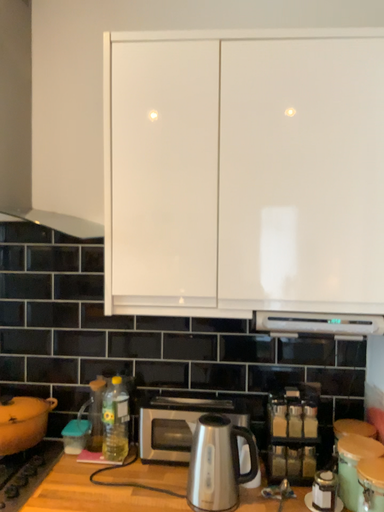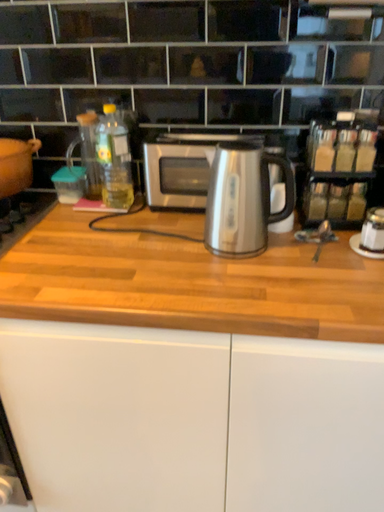
Question: How did the camera likely rotate when shooting the video?

Choices:
 (A) rotated upward
 (B) rotated downward

Answer: (B)